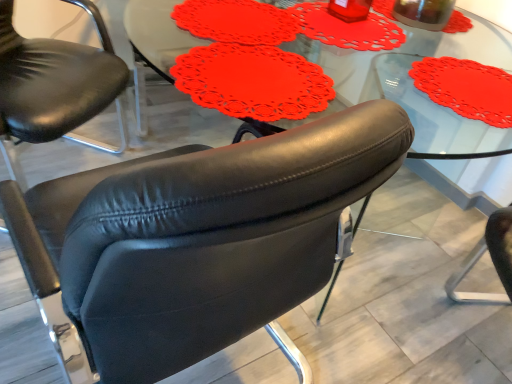
What is the approximate width of matte black armchair at center, which is the second chair from right to left?

The width of matte black armchair at center, which is the second chair from right to left, is 28.03 inches.

What do you see at coordinates (424, 13) in the screenshot? This screenshot has width=512, height=384. I see `transparent glass beverage at upper right` at bounding box center [424, 13].

What do you see at coordinates (194, 241) in the screenshot?
I see `black leather chair at center, which is the second chair in left-to-right order` at bounding box center [194, 241].

Find the location of a particular element. The height and width of the screenshot is (384, 512). matte black armchair at center, which is the second chair from right to left is located at coordinates (52, 84).

From the picture: Which point is more distant from viewer, (x=174, y=265) or (x=408, y=13)?

The point (x=408, y=13) is more distant.

Considering the relative sizes of black leather chair at center, which ranks as the 1th chair in right-to-left order, and transparent glass beverage at upper right in the image provided, is black leather chair at center, which ranks as the 1th chair in right-to-left order, bigger than transparent glass beverage at upper right?

Indeed, black leather chair at center, which ranks as the 1th chair in right-to-left order, has a larger size compared to transparent glass beverage at upper right.

Between black leather chair at center, which ranks as the 1th chair in right-to-left order, and transparent glass beverage at upper right, which one appears on the right side from the viewer's perspective?

transparent glass beverage at upper right.

How much distance is there between black leather chair at center, which ranks as the 1th chair in right-to-left order, and transparent glass beverage at upper right?

black leather chair at center, which ranks as the 1th chair in right-to-left order, is 1.13 meters away from transparent glass beverage at upper right.

Considering the relative sizes of matte black armchair at center, acting as the first chair starting from the left, and transparent glass beverage at upper right in the image provided, is matte black armchair at center, acting as the first chair starting from the left, taller than transparent glass beverage at upper right?

Correct, matte black armchair at center, acting as the first chair starting from the left, is much taller as transparent glass beverage at upper right.

Between matte black armchair at center, acting as the first chair starting from the left, and transparent glass beverage at upper right, which one has larger width?

matte black armchair at center, acting as the first chair starting from the left.

In terms of size, does matte black armchair at center, which is the second chair from right to left, appear bigger or smaller than transparent glass beverage at upper right?

Clearly, matte black armchair at center, which is the second chair from right to left, is larger in size than transparent glass beverage at upper right.

From a real-world perspective, between matte black armchair at center, which is the second chair from right to left, and transparent glass beverage at upper right, who is vertically higher?

In real-world perspective, transparent glass beverage at upper right is above.

From the image's perspective, which is above, black leather chair at center, which is the second chair in left-to-right order, or matte black armchair at center, acting as the first chair starting from the left?

matte black armchair at center, acting as the first chair starting from the left, from the image's perspective.

In the scene shown: Considering the relative positions of black leather chair at center, which is the second chair in left-to-right order, and matte black armchair at center, which is the second chair from right to left, in the image provided, is black leather chair at center, which is the second chair in left-to-right order, behind matte black armchair at center, which is the second chair from right to left,?

No.

Consider the image. From a real-world perspective, between black leather chair at center, which ranks as the 1th chair in right-to-left order, and matte black armchair at center, acting as the first chair starting from the left, who is vertically lower?

black leather chair at center, which ranks as the 1th chair in right-to-left order, from a real-world perspective.

Is matte black armchair at center, which is the second chair from right to left, at the back of black leather chair at center, which ranks as the 1th chair in right-to-left order?

No, black leather chair at center, which ranks as the 1th chair in right-to-left order, is not facing the opposite direction of matte black armchair at center, which is the second chair from right to left.

From the image's perspective, is transparent glass beverage at upper right located beneath matte red doily at center?

No, from the image's perspective, transparent glass beverage at upper right is not below matte red doily at center.

Can matte red doily at center be found inside transparent glass beverage at upper right?

No, transparent glass beverage at upper right does not contain matte red doily at center.

Can you tell me how much transparent glass beverage at upper right and matte red doily at center differ in facing direction?

There is a 0.000219-degree angle between the facing directions of transparent glass beverage at upper right and matte red doily at center.

Is transparent glass beverage at upper right oriented towards matte red doily at center?

No, transparent glass beverage at upper right is not facing towards matte red doily at center.

How many degrees apart are the facing directions of matte black armchair at center, which is the second chair from right to left, and matte red doily at center?

37.7 degrees separate the facing orientations of matte black armchair at center, which is the second chair from right to left, and matte red doily at center.

Is matte black armchair at center, which is the second chair from right to left, behind matte red doily at center?

Yes, it is.

Would you say matte black armchair at center, which is the second chair from right to left, is inside or outside matte red doily at center?

matte black armchair at center, which is the second chair from right to left, exists outside the volume of matte red doily at center.

Looking at this image, which object is positioned more to the right, matte red doily at center or matte black armchair at center, which is the second chair from right to left?

From the viewer's perspective, matte red doily at center appears more on the right side.

Does matte red doily at center have a smaller size compared to matte black armchair at center, acting as the first chair starting from the left?

Yes.

From their relative heights in the image, would you say matte red doily at center is taller or shorter than matte black armchair at center, which is the second chair from right to left?

Clearly, matte red doily at center is shorter compared to matte black armchair at center, which is the second chair from right to left.

Based on the photo, is matte red doily at center beside black leather chair at center, which is the second chair in left-to-right order?

matte red doily at center and black leather chair at center, which is the second chair in left-to-right order, are clearly separated.

Is matte red doily at center turned away from black leather chair at center, which ranks as the 1th chair in right-to-left order?

No, black leather chair at center, which ranks as the 1th chair in right-to-left order, is not at the back of matte red doily at center.

From the picture: Which of these two, matte red doily at center or black leather chair at center, which is the second chair in left-to-right order, stands taller?

Standing taller between the two is black leather chair at center, which is the second chair in left-to-right order.

From the picture: Which is more distant, (503, 153) or (124, 208)?

Positioned behind is point (503, 153).

Which chair is the 2nd one when counting from the front of the transparent glass beverage at upper right? Please provide its 2D coordinates.

[(194, 241)]

Locate an element on the screen. The width and height of the screenshot is (512, 384). beverage that is behind the matte black armchair at center, acting as the first chair starting from the left is located at coordinates (424, 13).

Which object lies further to the anchor point matte red doily at center, black leather chair at center, which is the second chair in left-to-right order, or transparent glass beverage at upper right?

black leather chair at center, which is the second chair in left-to-right order, is further to matte red doily at center.

From the image, which object appears to be nearer to transparent glass beverage at upper right, matte red doily at center or black leather chair at center, which ranks as the 1th chair in right-to-left order?

black leather chair at center, which ranks as the 1th chair in right-to-left order.

Looking at the image, which one is located closer to black leather chair at center, which ranks as the 1th chair in right-to-left order, matte red doily at center or matte black armchair at center, which is the second chair from right to left?

Among the two, matte black armchair at center, which is the second chair from right to left, is located nearer to black leather chair at center, which ranks as the 1th chair in right-to-left order.

Estimate the real-world distances between objects in this image. Which object is further from black leather chair at center, which ranks as the 1th chair in right-to-left order, matte black armchair at center, acting as the first chair starting from the left, or matte red doily at center?

Based on the image, matte red doily at center appears to be further to black leather chair at center, which ranks as the 1th chair in right-to-left order.

Based on their spatial positions, is black leather chair at center, which is the second chair in left-to-right order, or matte red doily at center closer to matte black armchair at center, acting as the first chair starting from the left?

The object closer to matte black armchair at center, acting as the first chair starting from the left, is black leather chair at center, which is the second chair in left-to-right order.

Considering their positions, is black leather chair at center, which is the second chair in left-to-right order, positioned closer to transparent glass beverage at upper right than matte red doily at center?

Based on the image, black leather chair at center, which is the second chair in left-to-right order, appears to be nearer to transparent glass beverage at upper right.

Which object lies nearer to the anchor point transparent glass beverage at upper right, matte black armchair at center, which is the second chair from right to left, or matte red doily at center?

matte black armchair at center, which is the second chair from right to left, is closer to transparent glass beverage at upper right.

Estimate the real-world distances between objects in this image. Which object is further from matte red doily at center, matte black armchair at center, which is the second chair from right to left, or black leather chair at center, which is the second chair in left-to-right order?

The object further to matte red doily at center is black leather chair at center, which is the second chair in left-to-right order.

What are the coordinates of `table between transparent glass beverage at upper right and black leather chair at center, which ranks as the 1th chair in right-to-left order, in the up-down direction` in the screenshot? It's located at (157, 34).

Locate an element on the screen. The width and height of the screenshot is (512, 384). chair between matte black armchair at center, which is the second chair from right to left, and transparent glass beverage at upper right from left to right is located at coordinates (194, 241).

Where is `table between matte black armchair at center, acting as the first chair starting from the left, and black leather chair at center, which is the second chair in left-to-right order, from left to right`? table between matte black armchair at center, acting as the first chair starting from the left, and black leather chair at center, which is the second chair in left-to-right order, from left to right is located at coordinates (157, 34).

Locate an element on the screen. The height and width of the screenshot is (384, 512). table situated between matte black armchair at center, which is the second chair from right to left, and transparent glass beverage at upper right from left to right is located at coordinates (157, 34).